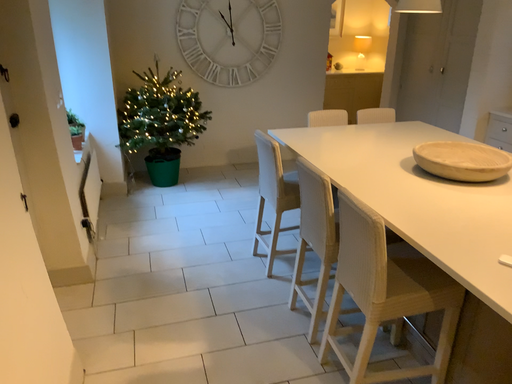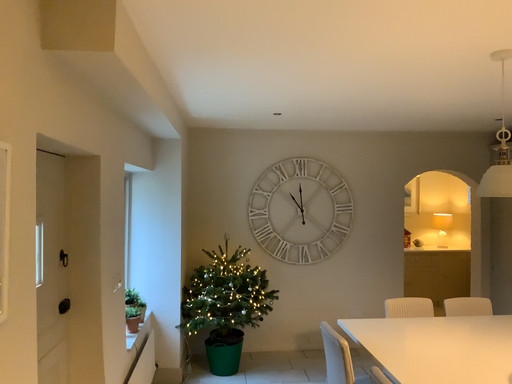
Question: How did the camera likely rotate when shooting the video?

Choices:
 (A) rotated right
 (B) rotated left

Answer: (B)